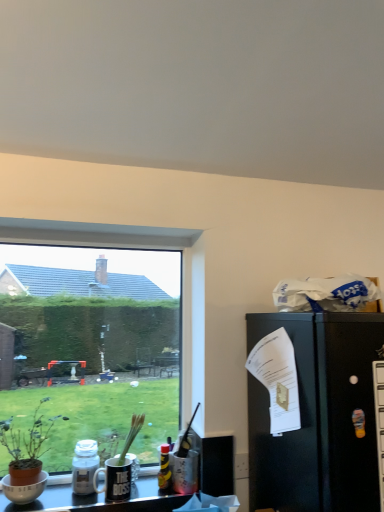
Locate an element on the screen. This screenshot has height=512, width=384. free space above transparent glass window at lower left (from a real-world perspective) is located at coordinates (87, 241).